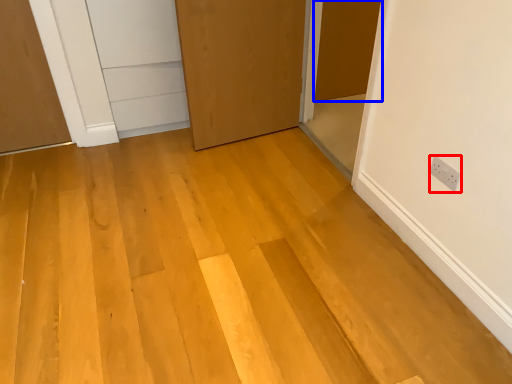
Question: Which object is further to the camera taking this photo, electric outlet (highlighted by a red box) or door (highlighted by a blue box)?

Choices:
 (A) electric outlet
 (B) door

Answer: (B)